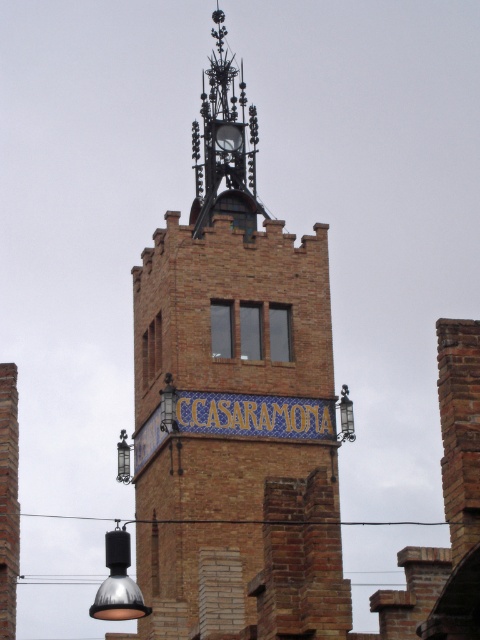
Between metallic glass at center and metallic lantern at center, which one has more height?

Standing taller between the two is metallic glass at center.

Is point (343, 400) less distant than point (122, 461)?

Yes, point (343, 400) is closer to viewer.

Where is `metallic glass at center`? Image resolution: width=480 pixels, height=640 pixels. metallic glass at center is located at coordinates [346, 417].

Is brown brick tower at center positioned at the back of metallic lantern at center?

That is False.

Can you confirm if brown brick tower at center is bigger than metallic lantern at center?

Yes.

I want to click on brown brick tower at center, so click(236, 406).

From the picture: Is brown brick tower at center shorter than matte black lamp at lower center?

In fact, brown brick tower at center may be taller than matte black lamp at lower center.

Is point (300, 268) less distant than point (108, 579)?

No, it is behind (108, 579).

Where is `brown brick tower at center`? This screenshot has width=480, height=640. brown brick tower at center is located at coordinates (236, 406).

Locate an element on the screen. The image size is (480, 640). brown brick tower at center is located at coordinates (236, 406).